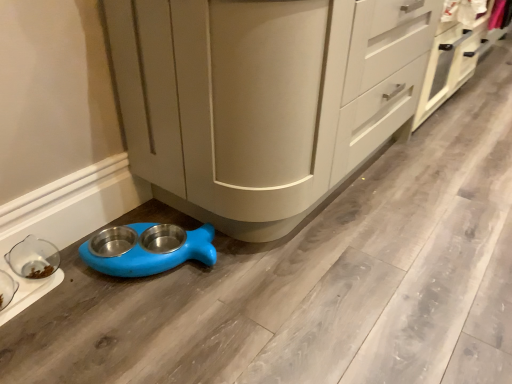
You are a GUI agent. You are given a task and a screenshot of the screen. Output one action in this format:
    pyautogui.click(x=<x>, y=<y>)
    Task: Click on the free point to the right of white matte cabinet at center, which is counted as the second cabinetry, starting from the left
    
    Given the screenshot: What is the action you would take?
    pyautogui.click(x=488, y=92)